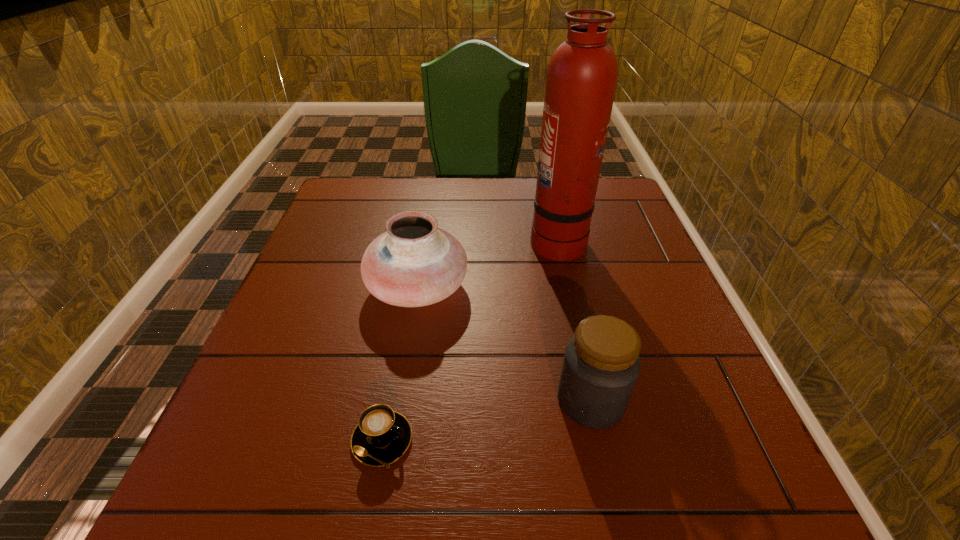
Find the location of a particular element. Image resolution: width=960 pixels, height=540 pixels. vacant region located on the surface of the jar near the warning symbol is located at coordinates 344,400.

You are a GUI agent. You are given a task and a screenshot of the screen. Output one action in this format:
    pyautogui.click(x=<x>, y=<y>)
    Task: Click on the vacant space located on the back of the shortest object
    
    Given the screenshot: What is the action you would take?
    pyautogui.click(x=401, y=331)

This screenshot has height=540, width=960. I want to click on object that is at the far edge, so click(x=582, y=74).

Where is `object positioned at the near edge`? object positioned at the near edge is located at coordinates (382, 436).

Where is `vacant region at the far edge of the desktop`? The image size is (960, 540). vacant region at the far edge of the desktop is located at coordinates (510, 188).

In the image, there is a desktop. At what (x,y) coordinates should I click in order to perform the action: click on vacant area at the near edge. Please return your answer as a coordinate pair (x, y). Image resolution: width=960 pixels, height=540 pixels. Looking at the image, I should click on (585, 463).

You are a GUI agent. You are given a task and a screenshot of the screen. Output one action in this format:
    pyautogui.click(x=<x>, y=<y>)
    Task: Click on the vacant space at the left edge of the desktop
    This screenshot has width=960, height=540.
    Given the screenshot: What is the action you would take?
    pyautogui.click(x=323, y=266)

In the image, there is a desktop. Identify the location of free space at the right edge. This screenshot has width=960, height=540. (687, 434).

The height and width of the screenshot is (540, 960). What are the coordinates of `vacant area at the far left corner` in the screenshot? It's located at (360, 179).

This screenshot has width=960, height=540. In the image, there is a desktop. In order to click on vacant area at the near right corner in this screenshot , I will do `click(745, 471)`.